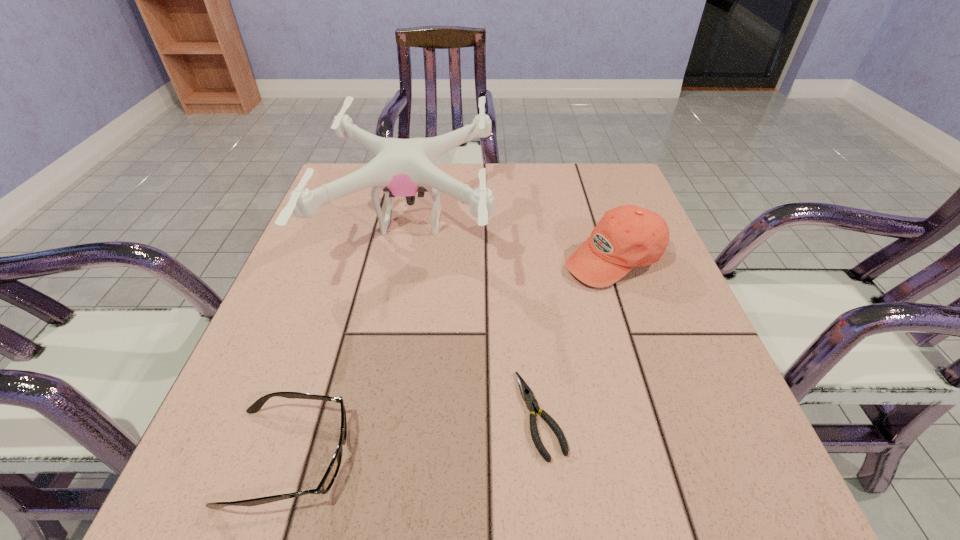
Identify the location of vacant region between the drone and the third tallest object. This screenshot has height=540, width=960. (350, 339).

Image resolution: width=960 pixels, height=540 pixels. Identify the location of vacant area that lies between the spectacles and the rightmost object. coord(451,358).

Where is `free area in between the pliers and the spectacles`? This screenshot has height=540, width=960. free area in between the pliers and the spectacles is located at coordinates (415, 436).

Image resolution: width=960 pixels, height=540 pixels. In order to click on free space between the tallest object and the shortest object in this screenshot , I will do `click(476, 318)`.

At what (x,y) coordinates should I click in order to perform the action: click on object that is the third nearest to the drone. Please return your answer as a coordinate pair (x, y). This screenshot has height=540, width=960. Looking at the image, I should click on (330, 475).

Identify which object is the nearest to the drone. Please provide its 2D coordinates. Your answer should be formatted as a tuple, i.e. [(x, y)], where the tuple contains the x and y coordinates of a point satisfying the conditions above.

[(627, 236)]

Find the location of a particular element. free space that satisfies the following two spatial constraints: 1. on the front side of the rightmost object; 2. on the front-facing side of the second shortest object is located at coordinates (682, 457).

Find the location of a particular element. The width and height of the screenshot is (960, 540). vacant space that satisfies the following two spatial constraints: 1. on the back side of the third shortest object; 2. on the top of the drone is located at coordinates (601, 221).

Find the location of `free space in the image that satisfies the following two spatial constraints: 1. on the front side of the shortest object; 2. on the front-facing side of the second shortest object`. free space in the image that satisfies the following two spatial constraints: 1. on the front side of the shortest object; 2. on the front-facing side of the second shortest object is located at coordinates (544, 457).

At what (x,y) coordinates should I click in order to perform the action: click on free location that satisfies the following two spatial constraints: 1. on the back side of the baseball cap; 2. on the top of the drone. Please return your answer as a coordinate pair (x, y). Image resolution: width=960 pixels, height=540 pixels. Looking at the image, I should click on (601, 221).